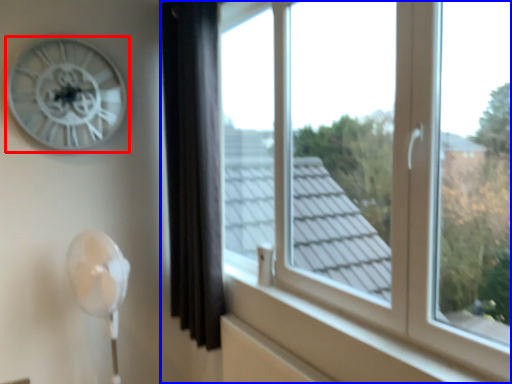
Question: Which object appears closest to the camera in this image, wall clock (highlighted by a red box) or window (highlighted by a blue box)?

Choices:
 (A) wall clock
 (B) window

Answer: (B)